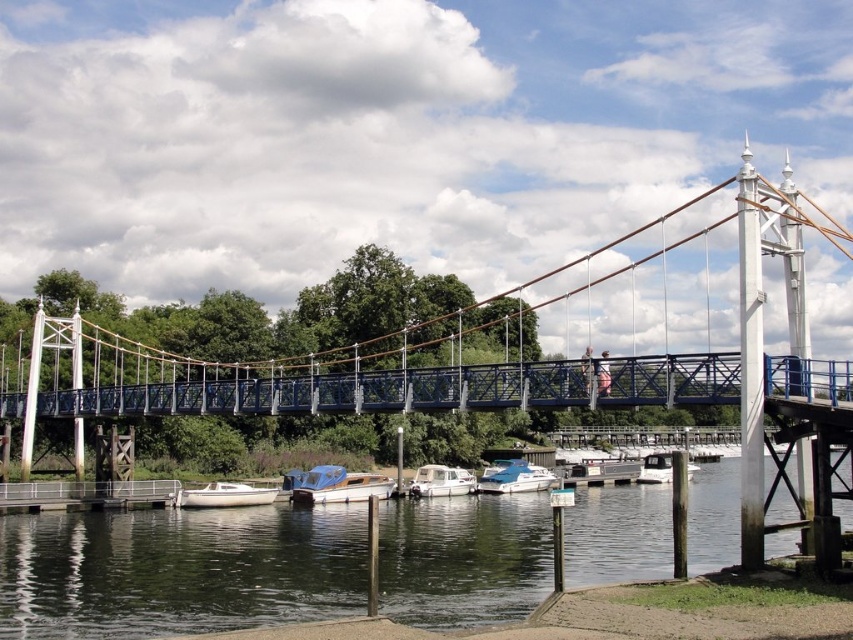
Question: Which point is closer to the camera?

Choices:
 (A) (165, 502)
 (B) (514, 458)
 (C) (126, 362)
 (D) (300, 484)

Answer: (A)

Question: Is metallic dock at lower left bigger than white glossy boat at lower left?

Choices:
 (A) yes
 (B) no

Answer: (A)

Question: Can you confirm if greenish water at lower center is positioned below blue glossy boat at center?

Choices:
 (A) yes
 (B) no

Answer: (A)

Question: Can you confirm if greenish water at lower center is smaller than white glossy boat at lower left?

Choices:
 (A) no
 (B) yes

Answer: (A)

Question: Considering the real-world distances, which object is closest to the metallic dock at lower left?

Choices:
 (A) blue glossy boat at center
 (B) white glossy boat at center
 (C) wooden polished boat at center
 (D) greenish water at lower center

Answer: (C)

Question: Which point appears farthest from the camera in this image?

Choices:
 (A) (355, 496)
 (B) (546, 476)
 (C) (409, 337)

Answer: (C)